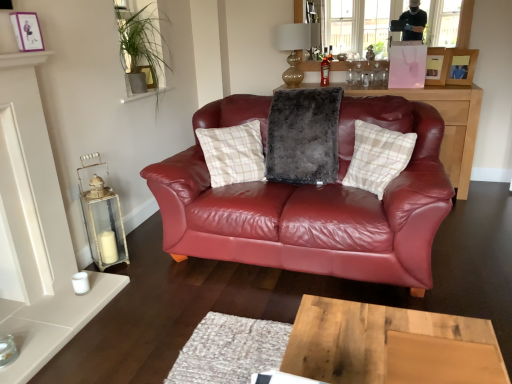
Image resolution: width=512 pixels, height=384 pixels. What are the coordinates of `vacant space in front of wooden picture frame at upper right, acting as the third picture frame starting from the left` in the screenshot? It's located at (461, 92).